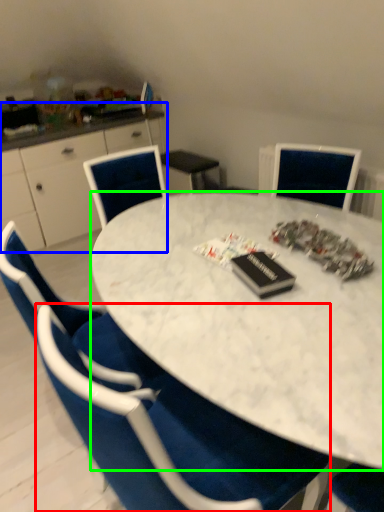
Question: Based on their relative distances, which object is farther from chair (highlighted by a red box)? Choose from computer desk (highlighted by a blue box) and desk (highlighted by a green box).

Choices:
 (A) computer desk
 (B) desk

Answer: (A)